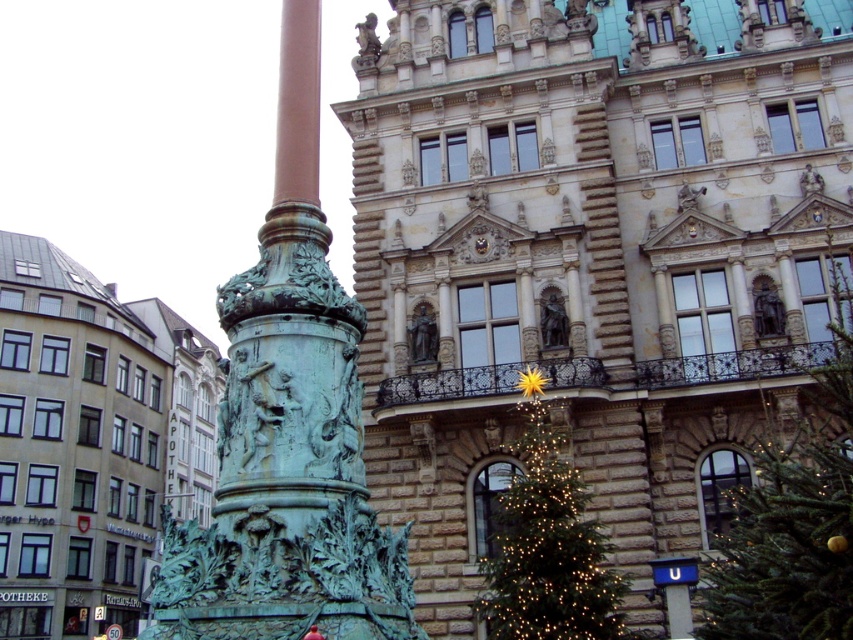
You are a delivery person with a cart that is 15 meters long. You need to move your cart between the green patina column at left and the green textured christmas tree at lower right. Will your cart fit in the space between them?

The distance between the green patina column at left and the green textured christmas tree at lower right is 14.96 meters. Since the cart is 15 meters long, it will not fit in the space between them.

You are standing in front of the grand building and see the green patina column at left and the green textured christmas tree at lower right. Which object is positioned higher relative to the other?

The green patina column at left is located above the green textured christmas tree at lower right, so it is positioned higher.

You are standing at the point marked by the coordinates point (x=288, y=428) in the image. What object is directly in front of you?

The point (x=288, y=428) corresponds to the green patina column at left, so the object directly in front of you is the green patina column at left.